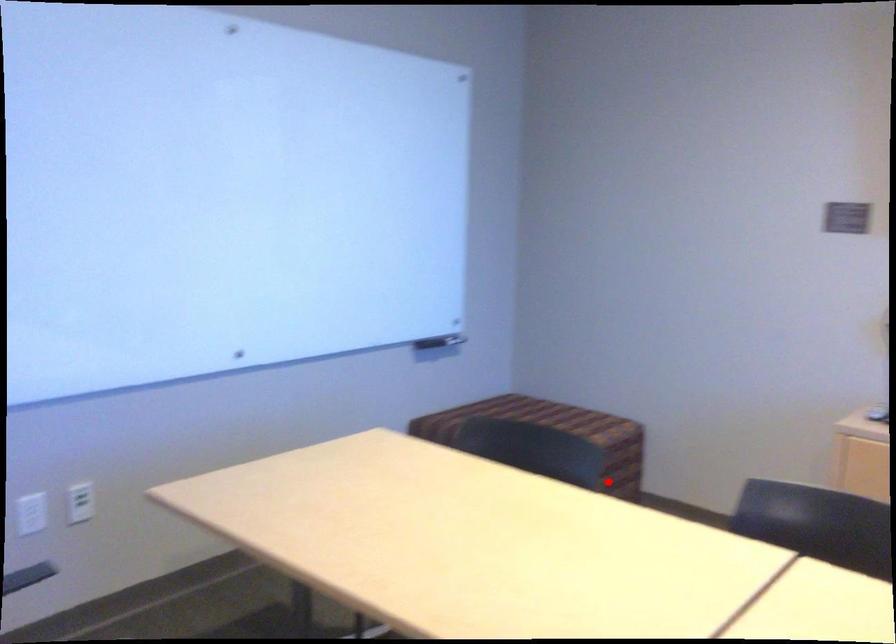
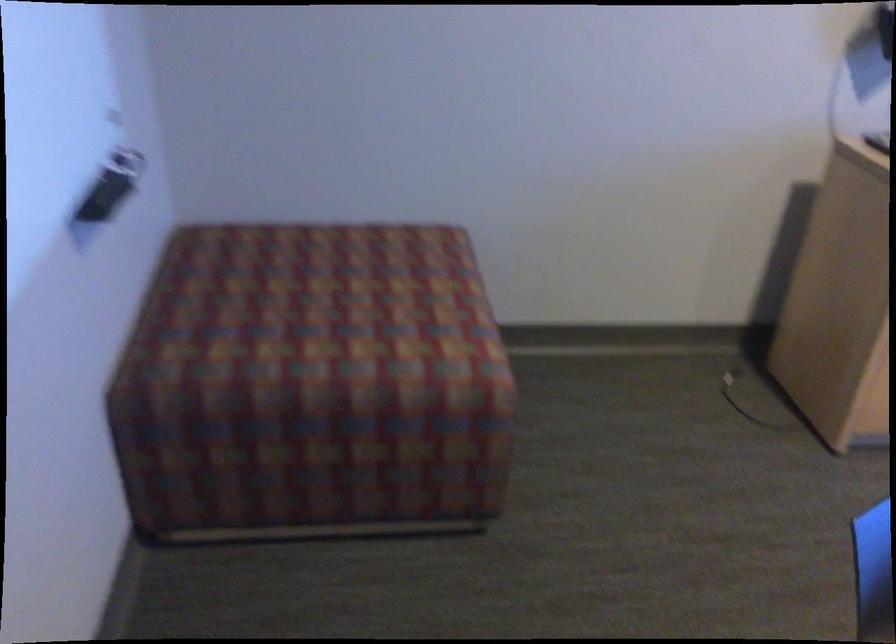
Question: I am providing you with two images of the same scene from different viewpoints. A red point is marked on the first image. At the location where the point appears in image 1, is it still visible in image 2?

Choices:
 (A) Yes
 (B) No

Answer: (B)